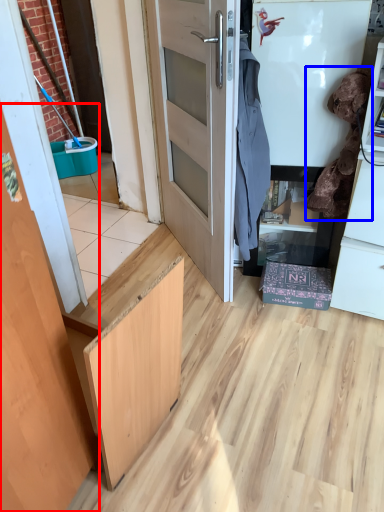
Question: Which point is closer to the camera, door (highlighted by a red box) or laundry (highlighted by a blue box)?

Choices:
 (A) door
 (B) laundry

Answer: (A)